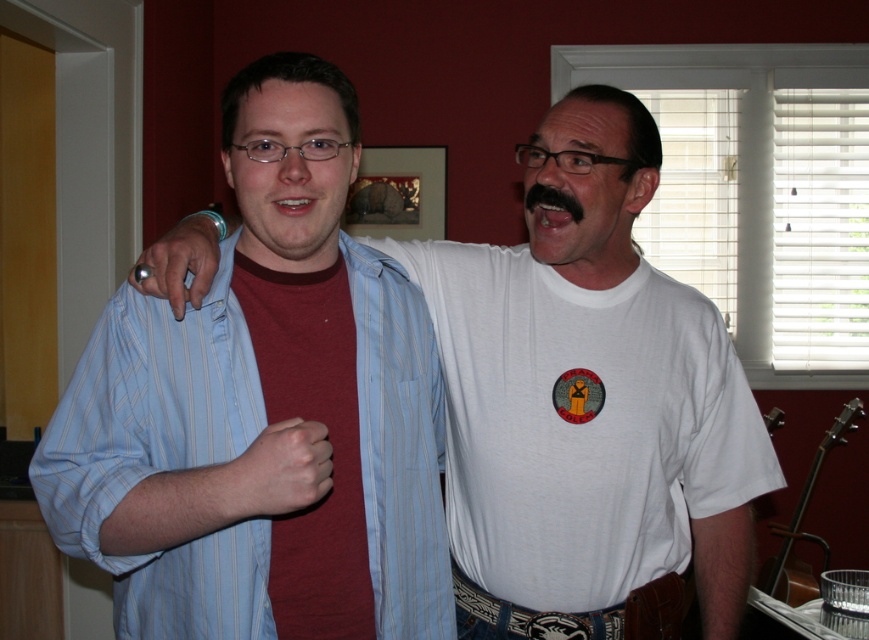
Question: Which point is farther to the camera?

Choices:
 (A) (535, 188)
 (B) (289, 202)
 (C) (575, 212)

Answer: (A)

Question: Is light blue striped shirt at center bigger than white glossy teeth at center?

Choices:
 (A) no
 (B) yes

Answer: (B)

Question: Is blue striped shirt at center bigger than black fuzzy mustache at upper center?

Choices:
 (A) no
 (B) yes

Answer: (B)

Question: Which object appears farthest from the camera in this image?

Choices:
 (A) light blue striped shirt at center
 (B) glossy pink lips at center
 (C) blue striped shirt at center
 (D) white glossy teeth at center

Answer: (B)

Question: Does glossy pink lips at center appear on the left side of black fuzzy mustache at upper center?

Choices:
 (A) yes
 (B) no

Answer: (B)

Question: Which point is farther to the camera?

Choices:
 (A) (551, 188)
 (B) (533, 412)
 (C) (536, 209)
 (D) (289, 211)

Answer: (B)